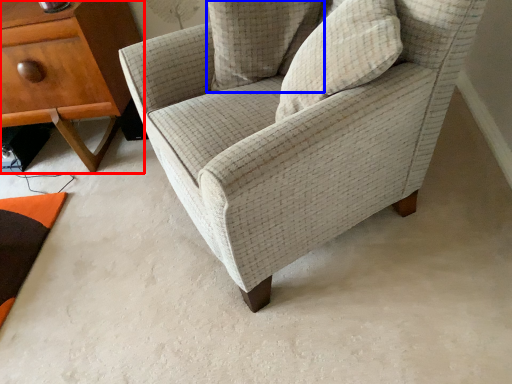
Question: Which object is further to the camera taking this photo, nightstand (highlighted by a red box) or pillow (highlighted by a blue box)?

Choices:
 (A) nightstand
 (B) pillow

Answer: (A)